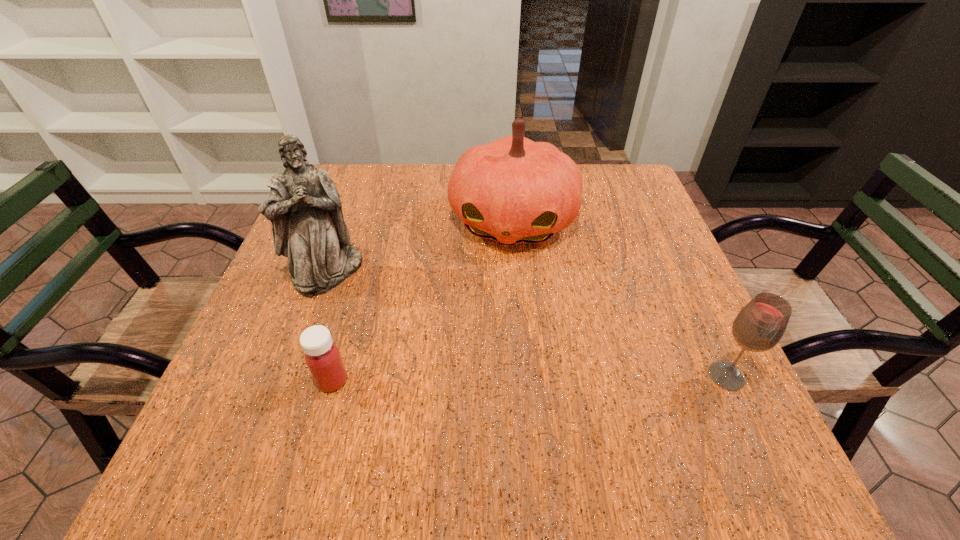
Locate an element on the screen. The height and width of the screenshot is (540, 960). object at the near left corner is located at coordinates (322, 356).

Locate an element on the screen. object present at the near right corner is located at coordinates (759, 326).

This screenshot has width=960, height=540. In order to click on vacant space at the far edge of the desktop in this screenshot , I will do `click(429, 210)`.

This screenshot has width=960, height=540. Identify the location of free spot at the near edge of the desktop. (629, 423).

This screenshot has height=540, width=960. Identify the location of vacant area at the left edge. (269, 318).

In the image, there is a desktop. At what (x,y) coordinates should I click in order to perform the action: click on blank space at the right edge. Please return your answer as a coordinate pair (x, y). Image resolution: width=960 pixels, height=540 pixels. Looking at the image, I should click on (612, 230).

In the image, there is a desktop. Where is `blank space at the far left corner`? blank space at the far left corner is located at coordinates (376, 186).

Where is `vacant space at the near left corner of the desktop`? The width and height of the screenshot is (960, 540). vacant space at the near left corner of the desktop is located at coordinates (252, 393).

Image resolution: width=960 pixels, height=540 pixels. I want to click on free space at the far right corner, so click(x=626, y=205).

Find the location of a particular element. vacant area at the near right corner of the desktop is located at coordinates (685, 382).